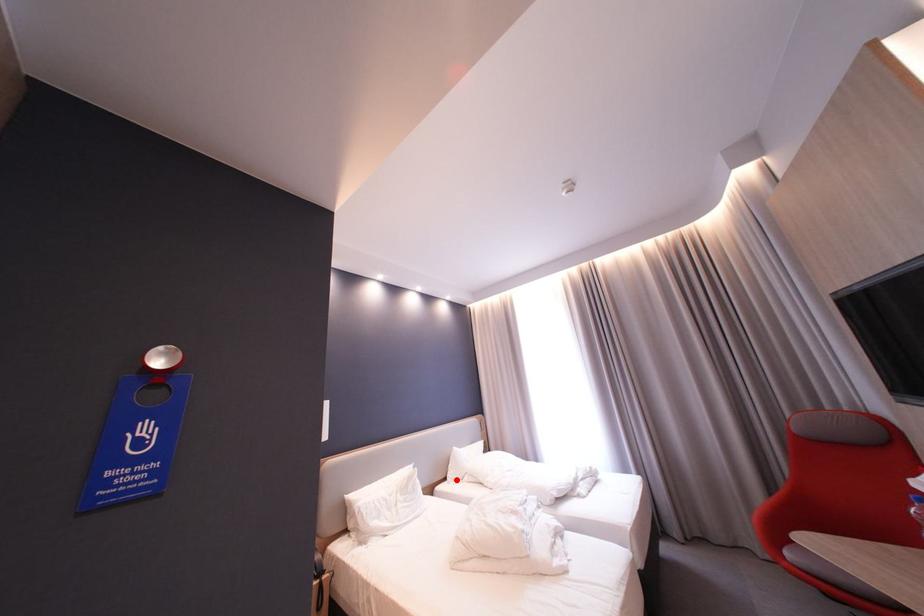
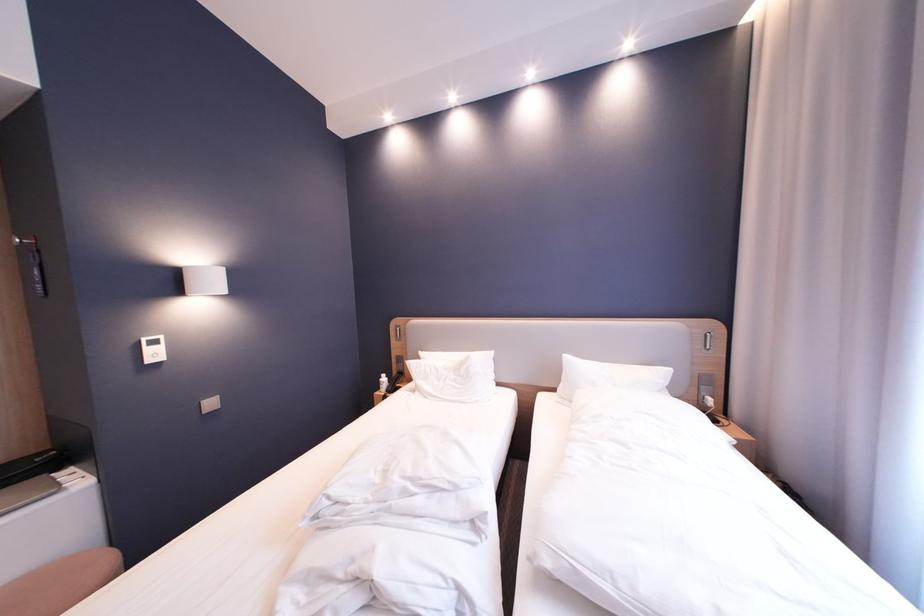
Find the pixel in the second image that matches the highlighted location in the first image.

(565, 391)